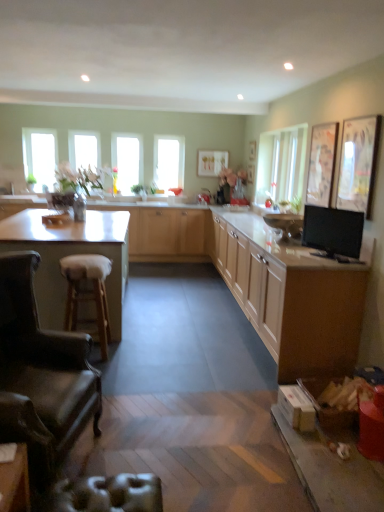
Question: In terms of width, does metallic silver swivel chair at lower left look wider or thinner when compared to light wood cabinet at center, which appears as the first cabinetry when viewed from the back?

Choices:
 (A) thin
 (B) wide

Answer: (A)

Question: Is metallic silver swivel chair at lower left spatially inside light wood cabinet at center, marked as the third cabinetry in a front-to-back arrangement, or outside of it?

Choices:
 (A) outside
 (B) inside

Answer: (A)

Question: Estimate the real-world distances between objects in this image. Which object is farther from the metallic silver swivel chair at lower left?

Choices:
 (A) light wood cabinet at center, marked as the third cabinetry in a front-to-back arrangement
 (B) white laminate countertop at left
 (C) wooden bar stool at left
 (D) black glossy tv at right
 (E) matte wood cabinets at center, marked as the 1th cabinetry in a front-to-back arrangement

Answer: (A)

Question: Which is farther from the clear glass window at upper center, the second window positioned from the left?

Choices:
 (A) clear glass window at upper left, acting as the fourth window starting from the right
 (B) metallic silver swivel chair at lower left
 (C) wooden bar stool at left
 (D) leather armchair at lower left
 (E) black glossy tv at right

Answer: (B)